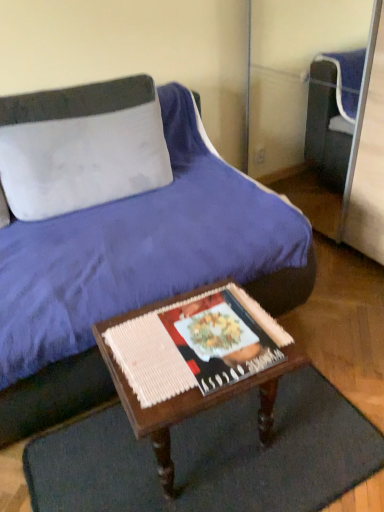
Question: From the image's perspective, is white fabric pillow at upper left positioned above or below wooden table at center?

Choices:
 (A) below
 (B) above

Answer: (B)

Question: In terms of width, does white fabric pillow at upper left look wider or thinner when compared to wooden table at center?

Choices:
 (A) wide
 (B) thin

Answer: (B)

Question: Based on their relative distances, which object is farther from the matte paper magazine at center?

Choices:
 (A) wooden table at center
 (B) dark brown woven mat at lower center
 (C) white fabric pillow at upper left
 (D) velvet blue bed at center

Answer: (C)

Question: Which of these objects is positioned farthest from the white fabric pillow at upper left?

Choices:
 (A) velvet blue bed at center
 (B) dark brown woven mat at lower center
 (C) wooden table at center
 (D) matte paper magazine at center

Answer: (B)